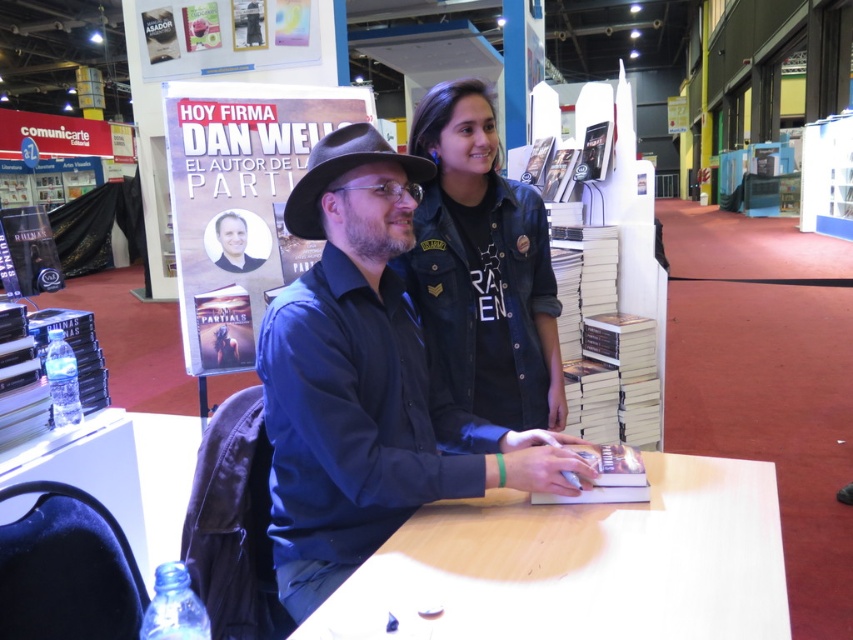
Question: In this image, where is blue shirt at center located relative to clear plastic water bottle at lower left?

Choices:
 (A) below
 (B) above

Answer: (B)

Question: Is blue shirt at center positioned in front of denim jacket at center?

Choices:
 (A) yes
 (B) no

Answer: (A)

Question: Is light wood table at center further to the viewer compared to brown felt cowboy hat at center?

Choices:
 (A) no
 (B) yes

Answer: (A)

Question: Which point is farther from the camera taking this photo?

Choices:
 (A) (311, 157)
 (B) (469, 212)
 (C) (525, 576)

Answer: (B)

Question: Estimate the real-world distances between objects in this image. Which object is closer to the blue shirt at center?

Choices:
 (A) light wood table at center
 (B) brown felt cowboy hat at center
 (C) denim jacket at center
 (D) clear plastic water bottle at lower left

Answer: (B)

Question: Which point is closer to the camera taking this photo?

Choices:
 (A) (532, 605)
 (B) (554, 364)
 (C) (100, 376)

Answer: (A)